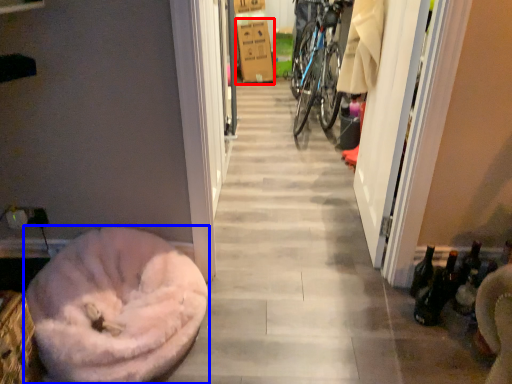
Question: Among these objects, which one is nearest to the camera, cardboard box (highlighted by a red box) or dog bed (highlighted by a blue box)?

Choices:
 (A) cardboard box
 (B) dog bed

Answer: (B)